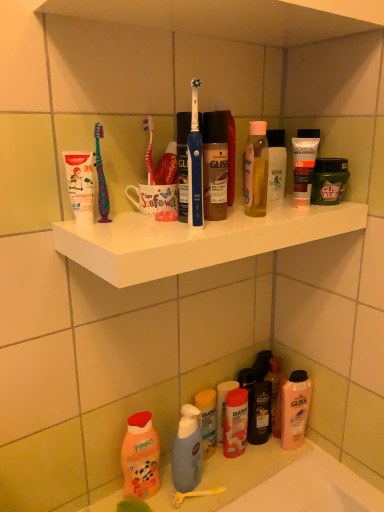
Image resolution: width=384 pixels, height=512 pixels. In order to click on free spot to the right of translucent plastic pump bottle at lower center, acting as the second toiletry starting from the left in this screenshot , I will do `click(254, 463)`.